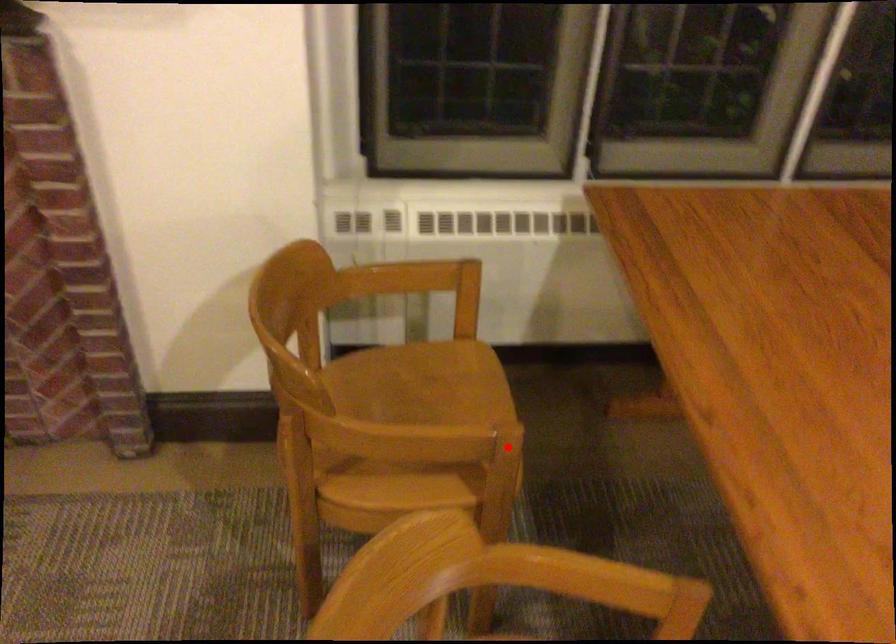
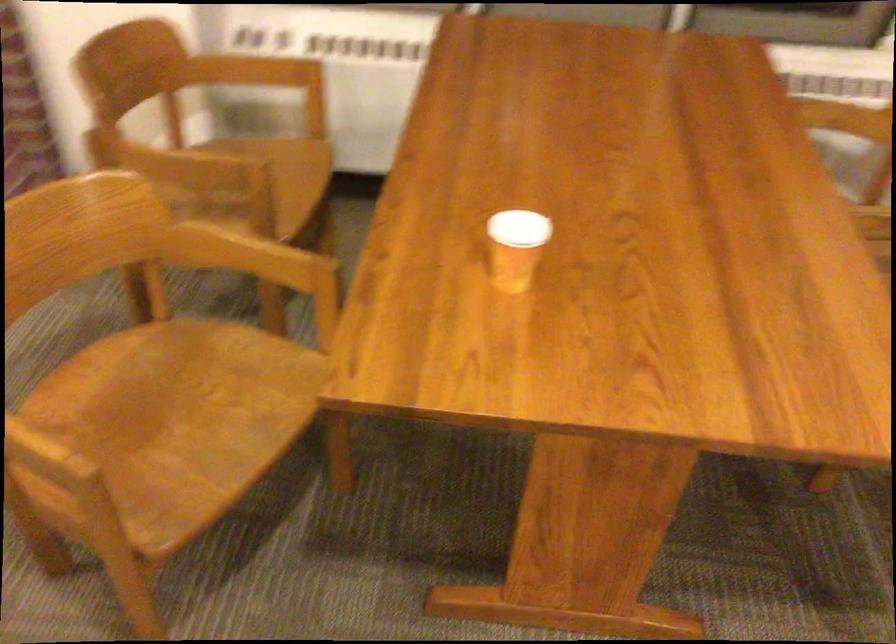
Locate, in the second image, the point that corresponds to the highlighted location in the first image.

(252, 182)